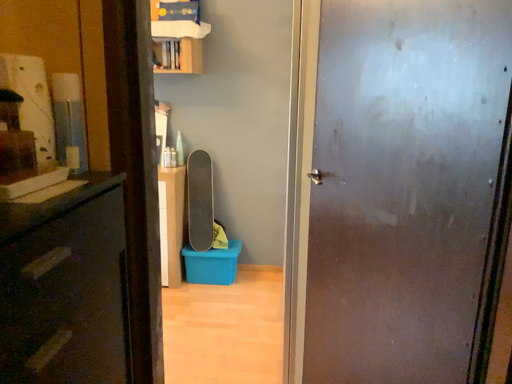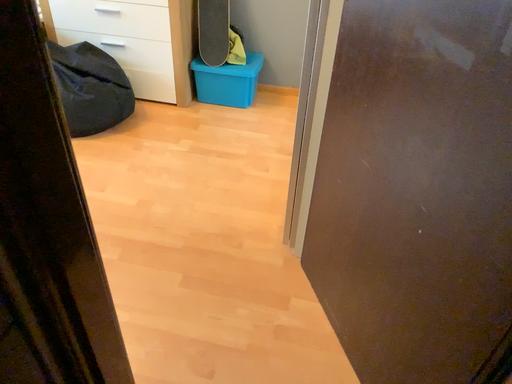
Question: Which way did the camera rotate in the video?

Choices:
 (A) rotated downward
 (B) rotated upward

Answer: (A)